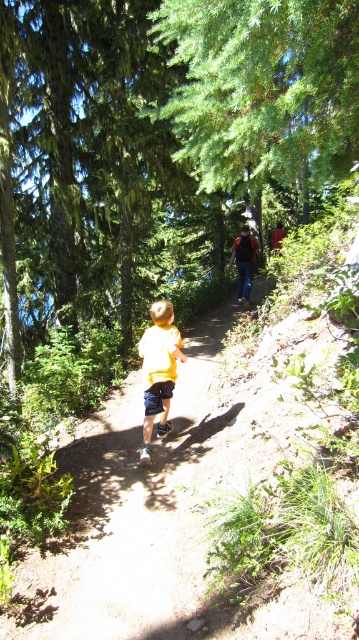
Does yellow fabric child at center have a lesser height compared to yellow matte shirt at center?

Indeed, yellow fabric child at center has a lesser height compared to yellow matte shirt at center.

Who is positioned more to the left, yellow fabric child at center or yellow matte shirt at center?

Positioned to the left is yellow fabric child at center.

Between point (196, 364) and point (170, 376), which one is positioned behind?

Point (196, 364)

Locate an element on the screen. This screenshot has height=640, width=359. yellow fabric child at center is located at coordinates (129, 515).

Between green leafy tree at upper center and yellow matte shirt at center, which one appears on the right side from the viewer's perspective?

Positioned to the right is green leafy tree at upper center.

Who is more distant from viewer, (268, 60) or (160, 348)?

The point (160, 348) is behind.

The width and height of the screenshot is (359, 640). What are the coordinates of `green leafy tree at upper center` in the screenshot? It's located at (263, 88).

Does yellow fabric child at center have a larger size compared to green leafy tree at upper center?

No, yellow fabric child at center is not bigger than green leafy tree at upper center.

Can you confirm if yellow fabric child at center is shorter than green leafy tree at upper center?

Correct, yellow fabric child at center is not as tall as green leafy tree at upper center.

What do you see at coordinates (129, 515) in the screenshot?
I see `yellow fabric child at center` at bounding box center [129, 515].

The image size is (359, 640). I want to click on yellow fabric child at center, so click(x=129, y=515).